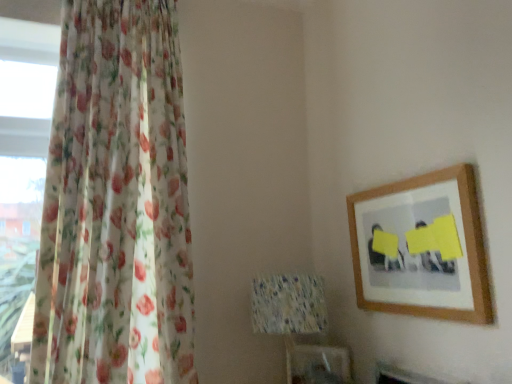
Where is `wooden picture frame at upper right`? wooden picture frame at upper right is located at coordinates point(422,248).

Image resolution: width=512 pixels, height=384 pixels. Identify the location of floral sheer curtain at left. (116, 204).

Does speckled fabric lampshade at center turn towards wooden picture frame at upper right?

No, speckled fabric lampshade at center is not facing towards wooden picture frame at upper right.

Is speckled fabric lampshade at center spatially inside wooden picture frame at upper right, or outside of it?

The correct answer is: outside.

Between speckled fabric lampshade at center and wooden picture frame at upper right, which one has larger size?

With larger size is speckled fabric lampshade at center.

Considering the points (304, 289) and (362, 225), which point is behind, point (304, 289) or point (362, 225)?

Point (362, 225)

How distant is floral sheer curtain at left from speckled fabric lampshade at center?

floral sheer curtain at left and speckled fabric lampshade at center are 22.06 inches apart.

Is point (168, 382) in front of point (271, 322)?

Yes.

Considering the relative sizes of floral sheer curtain at left and speckled fabric lampshade at center in the image provided, is floral sheer curtain at left smaller than speckled fabric lampshade at center?

Actually, floral sheer curtain at left might be larger than speckled fabric lampshade at center.

Considering the sizes of objects floral sheer curtain at left and speckled fabric lampshade at center in the image provided, who is thinner, floral sheer curtain at left or speckled fabric lampshade at center?

Thinner between the two is speckled fabric lampshade at center.

Is floral sheer curtain at left positioned far away from wooden picture frame at upper right?

Actually, floral sheer curtain at left and wooden picture frame at upper right are a little close together.

Is point (92, 96) positioned after point (467, 233)?

Yes, it is behind point (467, 233).

From the image's perspective, who appears lower, floral sheer curtain at left or wooden picture frame at upper right?

wooden picture frame at upper right.

Does wooden picture frame at upper right lie in front of floral sheer curtain at left?

No.

Considering the sizes of objects wooden picture frame at upper right and floral sheer curtain at left in the image provided, who is taller, wooden picture frame at upper right or floral sheer curtain at left?

Standing taller between the two is floral sheer curtain at left.

Can you tell me how much wooden picture frame at upper right and floral sheer curtain at left differ in facing direction?

wooden picture frame at upper right and floral sheer curtain at left are facing 88.9 degrees away from each other.

Which object is wider, wooden picture frame at upper right or floral sheer curtain at left?

A: floral sheer curtain at left.

Is wooden picture frame at upper right positioned with its back to speckled fabric lampshade at center?

No, wooden picture frame at upper right is not facing away from speckled fabric lampshade at center.

Considering the relative sizes of wooden picture frame at upper right and speckled fabric lampshade at center in the image provided, is wooden picture frame at upper right shorter than speckled fabric lampshade at center?

Correct, wooden picture frame at upper right is not as tall as speckled fabric lampshade at center.

Considering the relative sizes of wooden picture frame at upper right and speckled fabric lampshade at center in the image provided, is wooden picture frame at upper right thinner than speckled fabric lampshade at center?

Indeed, wooden picture frame at upper right has a lesser width compared to speckled fabric lampshade at center.

Considering the sizes of wooden picture frame at upper right and speckled fabric lampshade at center in the image, is wooden picture frame at upper right bigger or smaller than speckled fabric lampshade at center?

Considering their sizes, wooden picture frame at upper right takes up less space than speckled fabric lampshade at center.

From the image's perspective, which one is positioned lower, speckled fabric lampshade at center or floral sheer curtain at left?

speckled fabric lampshade at center is shown below in the image.

Is speckled fabric lampshade at center taller or shorter than floral sheer curtain at left?

speckled fabric lampshade at center is shorter than floral sheer curtain at left.

Is speckled fabric lampshade at center wider than floral sheer curtain at left?

In fact, speckled fabric lampshade at center might be narrower than floral sheer curtain at left.

Can you tell me how much speckled fabric lampshade at center and floral sheer curtain at left differ in facing direction?

The facing directions of speckled fabric lampshade at center and floral sheer curtain at left are 89.1 degrees apart.

This screenshot has width=512, height=384. Find the location of `table lamp to the left of wooden picture frame at upper right`. table lamp to the left of wooden picture frame at upper right is located at coordinates (288, 306).

I want to click on curtain located above the speckled fabric lampshade at center (from the image's perspective), so click(x=116, y=204).

Based on their spatial positions, is floral sheer curtain at left or wooden picture frame at upper right closer to speckled fabric lampshade at center?

Among the two, wooden picture frame at upper right is located nearer to speckled fabric lampshade at center.

When comparing their distances from wooden picture frame at upper right, does floral sheer curtain at left or speckled fabric lampshade at center seem further?

floral sheer curtain at left is further to wooden picture frame at upper right.

Estimate the real-world distances between objects in this image. Which object is further from floral sheer curtain at left, wooden picture frame at upper right or speckled fabric lampshade at center?

Among the two, wooden picture frame at upper right is located further to floral sheer curtain at left.

When comparing their distances from wooden picture frame at upper right, does speckled fabric lampshade at center or floral sheer curtain at left seem further?

floral sheer curtain at left.

When comparing their distances from speckled fabric lampshade at center, does wooden picture frame at upper right or floral sheer curtain at left seem closer?

wooden picture frame at upper right.

From the image, which object appears to be nearer to floral sheer curtain at left, speckled fabric lampshade at center or wooden picture frame at upper right?

The object closer to floral sheer curtain at left is speckled fabric lampshade at center.

Find the location of a particular element. This screenshot has height=384, width=512. table lamp between floral sheer curtain at left and wooden picture frame at upper right from left to right is located at coordinates (288, 306).